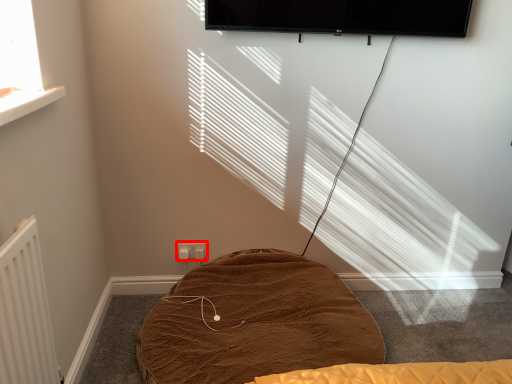
Question: From the image, what is the correct spatial relationship of electric outlet (annotated by the red box) in relation to furniture?

Choices:
 (A) right
 (B) left

Answer: (B)